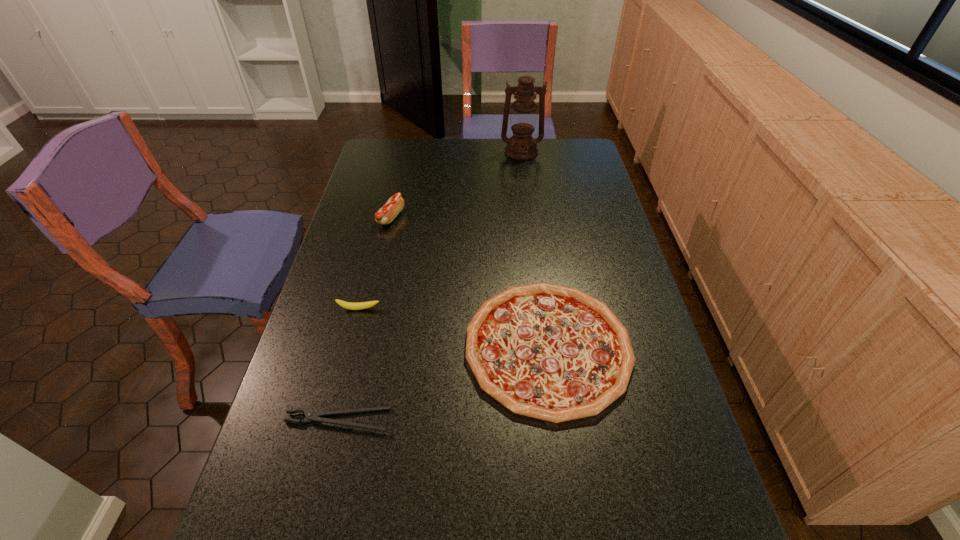
Identify the location of free space located on the left of the second shortest object. point(423,347).

This screenshot has width=960, height=540. Identify the location of vacant region located on the back of the shortest object. (351, 364).

This screenshot has width=960, height=540. What are the coordinates of `object present at the far edge` in the screenshot? It's located at (521, 146).

In order to click on sausage that is at the left edge in this screenshot , I will do `click(385, 215)`.

Image resolution: width=960 pixels, height=540 pixels. In order to click on banana at the left edge in this screenshot , I will do `click(347, 305)`.

The height and width of the screenshot is (540, 960). Find the location of `tongs present at the left edge`. tongs present at the left edge is located at coordinates (311, 416).

Where is `object at the right edge`? This screenshot has height=540, width=960. object at the right edge is located at coordinates (546, 351).

The height and width of the screenshot is (540, 960). In the image, there is a desktop. In order to click on free space at the far edge in this screenshot , I will do `click(493, 147)`.

This screenshot has width=960, height=540. In the image, there is a desktop. In order to click on vacant area at the left edge in this screenshot , I will do `click(374, 247)`.

You are a GUI agent. You are given a task and a screenshot of the screen. Output one action in this format:
    pyautogui.click(x=<x>, y=<y>)
    Task: Click on the free spot at the right edge of the desktop
    The height and width of the screenshot is (540, 960).
    Given the screenshot: What is the action you would take?
    pyautogui.click(x=625, y=417)